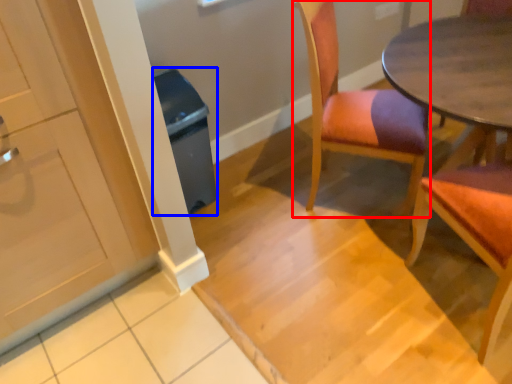
Question: Which of the following is the farthest to the observer, chair (highlighted by a red box) or trash bin/can (highlighted by a blue box)?

Choices:
 (A) chair
 (B) trash bin/can

Answer: (B)